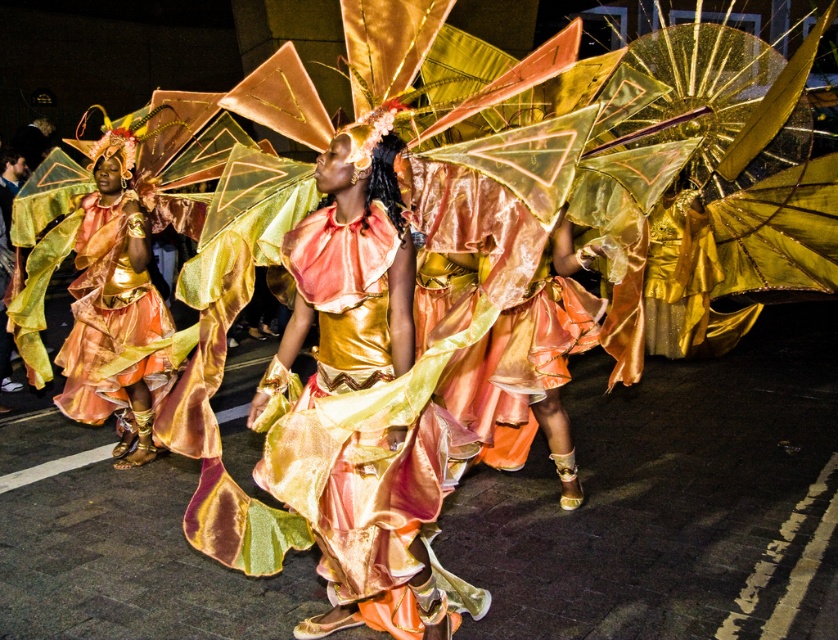
Question: Considering the relative positions of shiny satin dress at center and metallic gold dress at left in the image provided, where is shiny satin dress at center located with respect to metallic gold dress at left?

Choices:
 (A) below
 (B) above

Answer: (A)

Question: Which point is farther to the camera?

Choices:
 (A) (123, 346)
 (B) (316, 426)

Answer: (A)

Question: Among these points, which one is farthest from the camera?

Choices:
 (A) (270, 404)
 (B) (147, 221)

Answer: (B)

Question: Can you confirm if shiny satin dress at center is smaller than metallic gold dress at left?

Choices:
 (A) yes
 (B) no

Answer: (A)

Question: Can you confirm if shiny satin dress at center is wider than metallic gold dress at left?

Choices:
 (A) yes
 (B) no

Answer: (B)